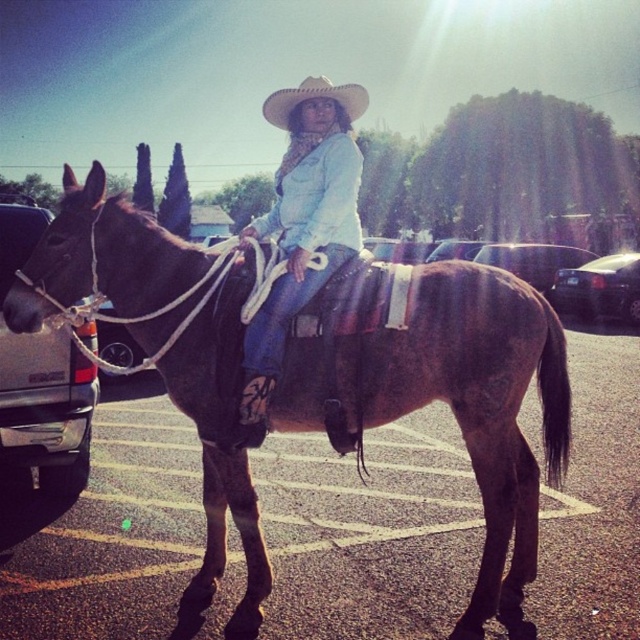
Who is positioned more to the right, denim jacket at center or glossy black car at center?

Positioned to the right is glossy black car at center.

Is point (291, 276) less distant than point (552, 253)?

Yes.

This screenshot has height=640, width=640. What are the coordinates of `denim jacket at center` in the screenshot? It's located at (301, 225).

In the scene shown: Does brushed metal truck at left have a larger size compared to light beige straw cowboy hat at center?

Incorrect, brushed metal truck at left is not larger than light beige straw cowboy hat at center.

Is brushed metal truck at left closer to camera compared to light beige straw cowboy hat at center?

No, brushed metal truck at left is behind light beige straw cowboy hat at center.

Who is more distant from viewer, (4,372) or (301,92)?

Positioned behind is point (4,372).

Identify the location of brushed metal truck at left. (42, 428).

Is point (22, 456) behind point (525, 262)?

No, it is in front of (525, 262).

Does brushed metal truck at left appear on the left side of glossy black car at center?

Correct, you'll find brushed metal truck at left to the left of glossy black car at center.

Does point (44, 227) lie in front of point (508, 266)?

Yes.

Find the location of a particular element. The height and width of the screenshot is (640, 640). brushed metal truck at left is located at coordinates (42, 428).